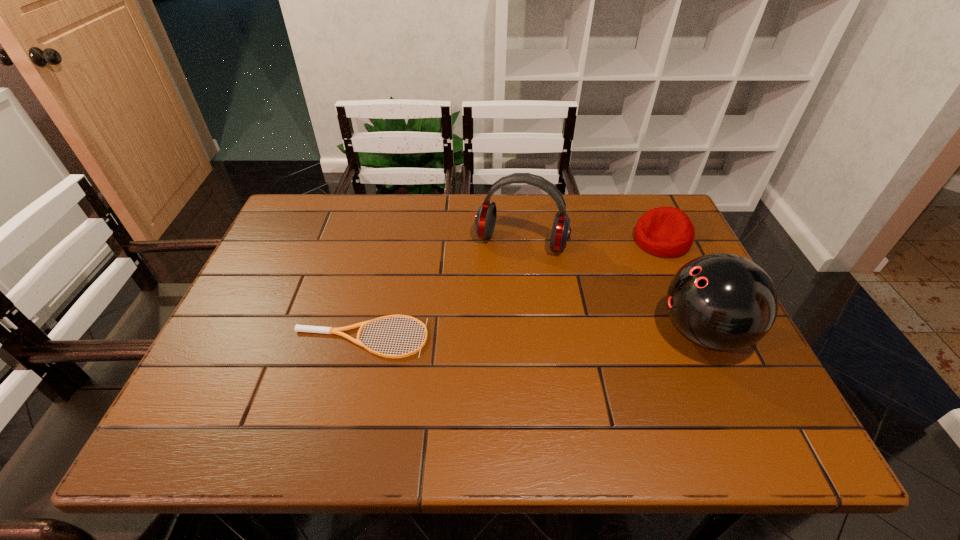
Identify the location of free space located on the ear cups of the earphone. Image resolution: width=960 pixels, height=540 pixels. (486, 336).

Identify the location of vacant area situated on the ear cups of the earphone. The width and height of the screenshot is (960, 540). (491, 320).

The width and height of the screenshot is (960, 540). Find the location of `vacant area situated 0.140m on the seat area of the second shortest object`. vacant area situated 0.140m on the seat area of the second shortest object is located at coordinates (612, 275).

Locate an element on the screen. The width and height of the screenshot is (960, 540). blank space located on the seat area of the second shortest object is located at coordinates (617, 272).

Where is `vacant region located 0.110m on the seat area of the second shortest object`? This screenshot has width=960, height=540. vacant region located 0.110m on the seat area of the second shortest object is located at coordinates (620, 270).

At what (x,y) coordinates should I click in order to perform the action: click on earphone located in the far edge section of the desktop. Please return your answer as a coordinate pair (x, y). This screenshot has width=960, height=540. Looking at the image, I should click on (485, 219).

At what (x,y) coordinates should I click in order to perform the action: click on beanbag that is at the far edge. Please return your answer as a coordinate pair (x, y). The image size is (960, 540). Looking at the image, I should click on (668, 232).

Where is `object that is at the near edge`? This screenshot has height=540, width=960. object that is at the near edge is located at coordinates (721, 302).

You are a GUI agent. You are given a task and a screenshot of the screen. Output one action in this format:
    pyautogui.click(x=<x>, y=<y>)
    Task: Click on the bowling ball that is at the right edge
    This screenshot has height=540, width=960.
    Given the screenshot: What is the action you would take?
    pyautogui.click(x=721, y=302)

At what (x,y) coordinates should I click in order to perform the action: click on beanbag present at the right edge. Please return your answer as a coordinate pair (x, y). This screenshot has width=960, height=540. Looking at the image, I should click on (668, 232).